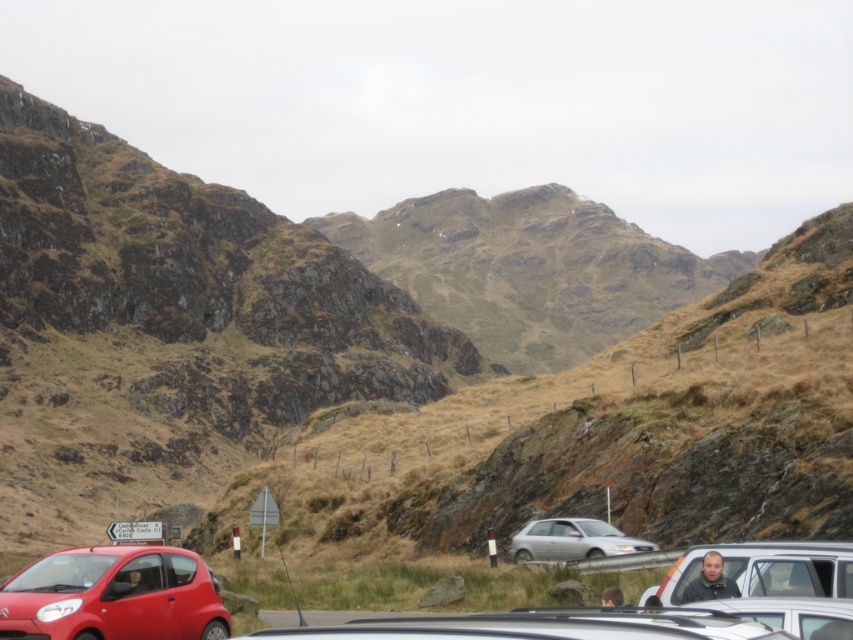
Can you confirm if shiny red car at lower left is shorter than dark gray shirt at lower right?

Incorrect, shiny red car at lower left's height does not fall short of dark gray shirt at lower right's.

Is shiny red car at lower left below dark gray shirt at lower right?

Yes, shiny red car at lower left is below dark gray shirt at lower right.

Is point (129, 564) less distant than point (734, 593)?

No, (129, 564) is further to viewer.

This screenshot has height=640, width=853. In order to click on shiny red car at lower left in this screenshot , I will do `click(114, 595)`.

Which is above, shiny red car at lower left or matte silver van at lower right?

shiny red car at lower left is higher up.

Looking at this image, can you confirm if shiny red car at lower left is wider than matte silver van at lower right?

In fact, shiny red car at lower left might be narrower than matte silver van at lower right.

Image resolution: width=853 pixels, height=640 pixels. Describe the element at coordinates (114, 595) in the screenshot. I see `shiny red car at lower left` at that location.

The image size is (853, 640). What are the coordinates of `shiny red car at lower left` in the screenshot? It's located at (114, 595).

Between shiny red car at lower left and satin silver sedan at center, which one is positioned lower?

satin silver sedan at center

Is point (132, 618) closer to viewer compared to point (550, 531)?

Yes, point (132, 618) is closer to viewer.

Where is `shiny red car at lower left`? Image resolution: width=853 pixels, height=640 pixels. shiny red car at lower left is located at coordinates (114, 595).